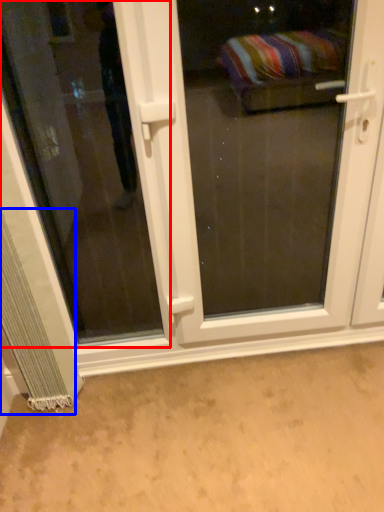
Question: Among these objects, which one is nearest to the camera, window (highlighted by a red box) or curtain (highlighted by a blue box)?

Choices:
 (A) window
 (B) curtain

Answer: (A)